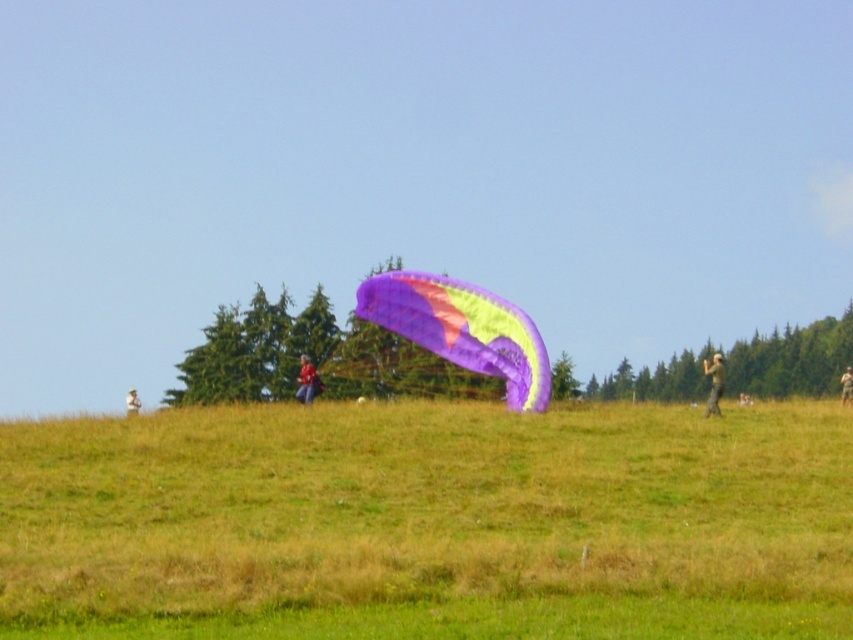
Who is lower down, camouflage fabric person at right or light brown fabric jacket at center?

light brown fabric jacket at center

Is point (850, 374) closer to camera compared to point (131, 396)?

No, it is behind (131, 396).

The image size is (853, 640). What are the coordinates of `camouflage fabric person at right` in the screenshot? It's located at (846, 387).

Which is below, blurred green pants at center or camouflage fabric person at right?

camouflage fabric person at right is below.

Identify the location of blurred green pants at center. The image size is (853, 640). (714, 381).

Is point (711, 385) positioned behind point (851, 381)?

That is True.

I want to click on blurred green pants at center, so click(x=714, y=381).

Which is above, green grassy field at center or camouflage fabric jacket at center?

camouflage fabric jacket at center is above.

Is green grassy field at center below camouflage fabric jacket at center?

Correct, green grassy field at center is located below camouflage fabric jacket at center.

Is point (485, 566) more distant than point (300, 371)?

No.

Where is `green grassy field at center`? This screenshot has height=640, width=853. green grassy field at center is located at coordinates (428, 522).